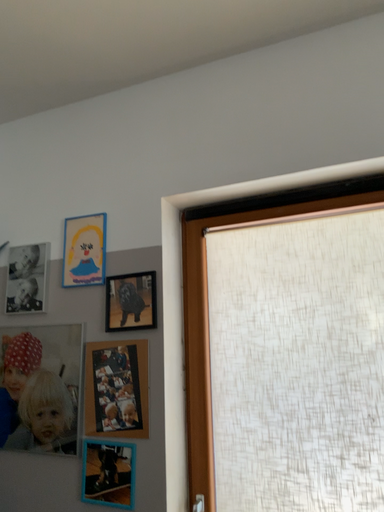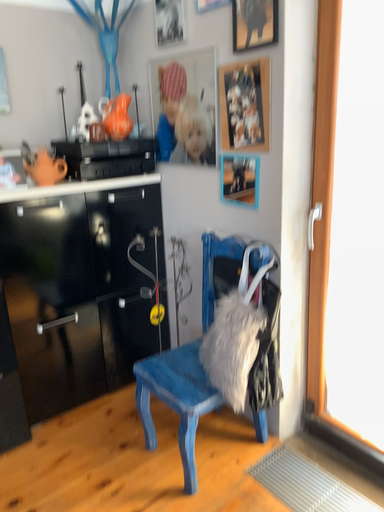
Question: How did the camera likely rotate when shooting the video?

Choices:
 (A) rotated left
 (B) rotated right

Answer: (A)